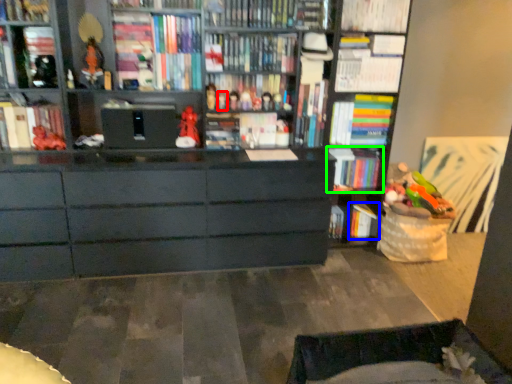
Question: Which is farther away from toy (highlighted by a red box)? book (highlighted by a blue box) or book (highlighted by a green box)?

Choices:
 (A) book
 (B) book

Answer: (A)